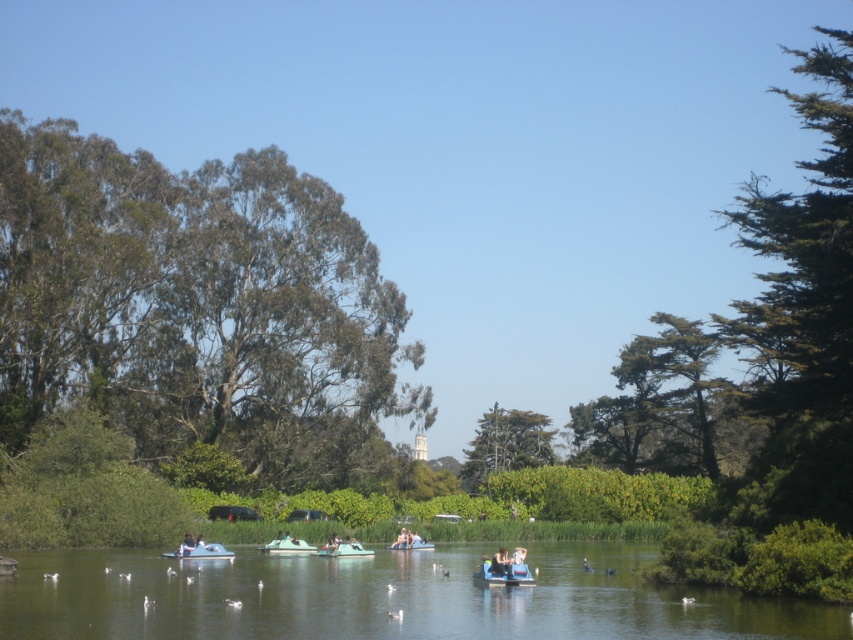
Is blue plastic boat at center smaller than white plastic boat at center?

Yes, blue plastic boat at center is smaller than white plastic boat at center.

Can you confirm if blue plastic boat at center is wider than white plastic boat at center?

Incorrect, blue plastic boat at center's width does not surpass white plastic boat at center's.

Does point (511, 564) come behind point (276, 538)?

No, (511, 564) is closer to viewer.

In order to click on blue plastic boat at center in this screenshot , I will do `click(503, 573)`.

Between green leafy tree at upper left and blue plastic boat at center, which one appears on the left side from the viewer's perspective?

Positioned to the left is green leafy tree at upper left.

Who is taller, green leafy tree at upper left or blue plastic boat at center?

green leafy tree at upper left is taller.

Which is in front, point (86, 248) or point (480, 564)?

Point (480, 564) is more forward.

At what (x,y) coordinates should I click in order to perform the action: click on green leafy tree at upper left. Please return your answer as a coordinate pair (x, y). Image resolution: width=853 pixels, height=640 pixels. Looking at the image, I should click on (196, 308).

Is green leafy tree at upper left thinner than green rubber boats at lower center?

Correct, green leafy tree at upper left's width is less than green rubber boats at lower center's.

Does green leafy tree at upper left have a greater width compared to green rubber boats at lower center?

No, green leafy tree at upper left is not wider than green rubber boats at lower center.

Between point (305, 228) and point (218, 596), which one is positioned in front?

Positioned in front is point (218, 596).

Image resolution: width=853 pixels, height=640 pixels. Find the location of `green leafy tree at upper left`. green leafy tree at upper left is located at coordinates (196, 308).